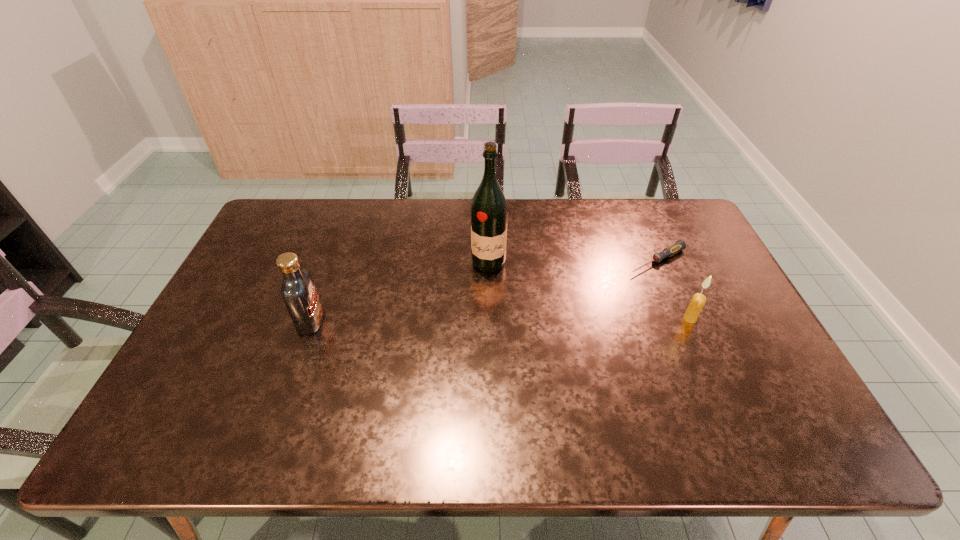
Locate an element on the screen. This screenshot has height=540, width=960. vacant space at the far left corner of the desktop is located at coordinates (308, 218).

This screenshot has width=960, height=540. I want to click on free spot between the leftmost object and the candle, so click(x=500, y=320).

Locate an element on the screen. vacant space that's between the leftmost object and the screwdriver is located at coordinates (484, 291).

Locate an element on the screen. free area in between the screwdriver and the liquor is located at coordinates (573, 261).

Image resolution: width=960 pixels, height=540 pixels. Find the location of `vacant area that lies between the tallest object and the candle`. vacant area that lies between the tallest object and the candle is located at coordinates (589, 291).

Locate an element on the screen. This screenshot has height=540, width=960. vacant area that lies between the candle and the shortest object is located at coordinates (674, 289).

At what (x,y) coordinates should I click in order to perform the action: click on empty space between the second object from left to right and the third tallest object. Please return your answer as a coordinate pair (x, y). Image resolution: width=960 pixels, height=540 pixels. Looking at the image, I should click on (589, 291).

Find the location of `free space between the candle and the tallest object`. free space between the candle and the tallest object is located at coordinates (589, 291).

Locate an element on the screen. free space between the tallest object and the shortest object is located at coordinates (573, 261).

Locate an element on the screen. The image size is (960, 540). empty location between the tallest object and the shortest object is located at coordinates (573, 261).